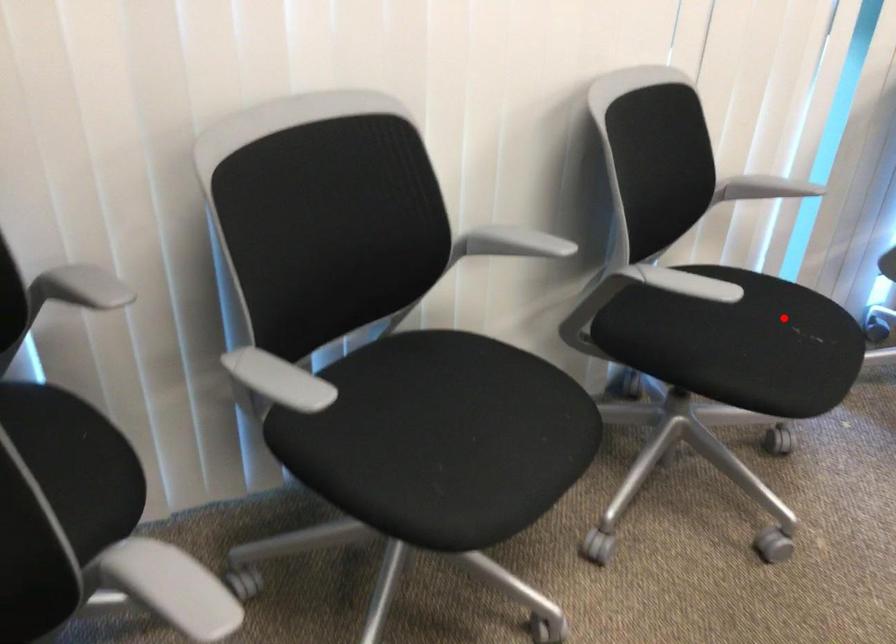
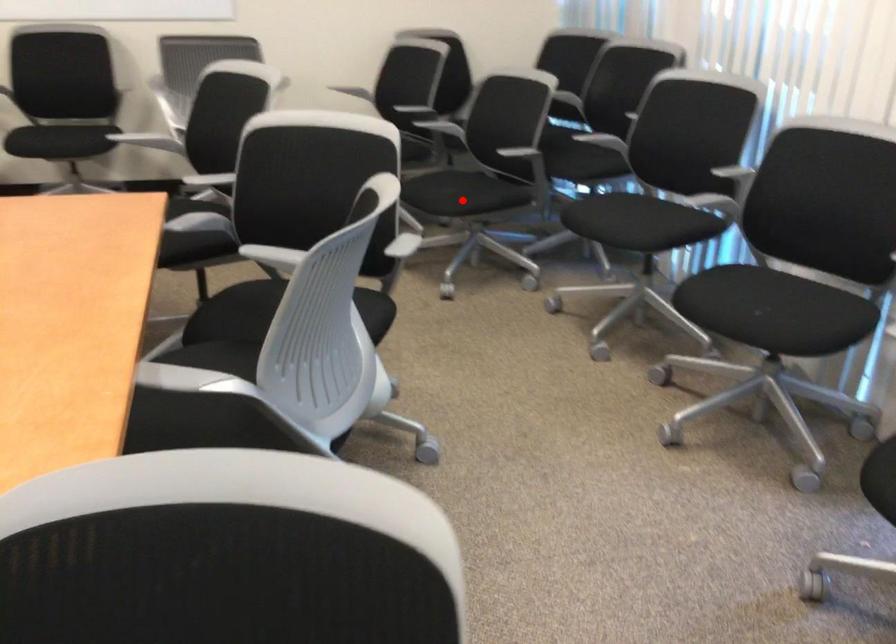
I am providing you with two images of the same scene from different viewpoints. A red point is marked on the first image and another point is marked on the second image. Do the highlighted points in image1 and image2 indicate the same real-world spot?

No